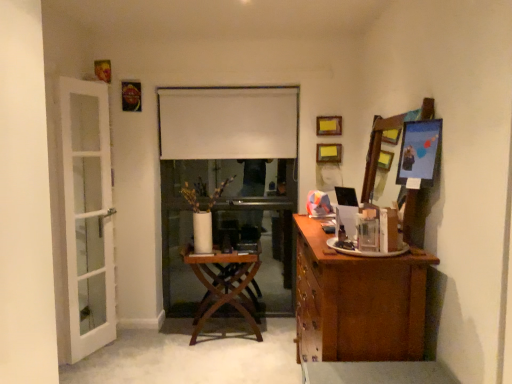
This screenshot has height=384, width=512. Find the location of `space that is in front of white glass door at left`. space that is in front of white glass door at left is located at coordinates (92, 371).